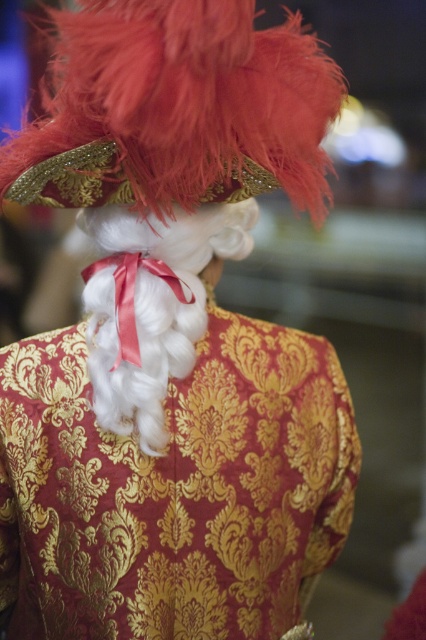
Question: Which point appears farthest from the camera in this image?

Choices:
 (A) (158, 54)
 (B) (98, 224)

Answer: (B)

Question: Which point is farther from the camera taking this photo?

Choices:
 (A) (201, 307)
 (B) (17, 134)

Answer: (A)

Question: Which point appears closest to the camera in this image?

Choices:
 (A) (98, 180)
 (B) (242, 241)

Answer: (A)

Question: Observing the image, what is the correct spatial positioning of feathered gold hat at upper center in reference to white silky wig at center?

Choices:
 (A) above
 (B) below

Answer: (A)

Question: Is feathered gold hat at upper center bigger than white silky wig at center?

Choices:
 (A) yes
 (B) no

Answer: (A)

Question: Does feathered gold hat at upper center appear on the right side of white silky wig at center?

Choices:
 (A) yes
 (B) no

Answer: (A)